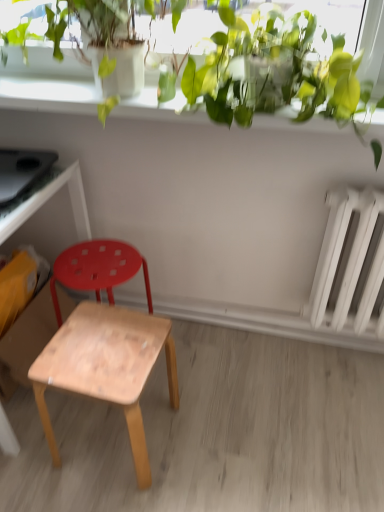
Question: Is white matte radiator at right in front of or behind green leafy plant at upper center in the image?

Choices:
 (A) front
 (B) behind

Answer: (B)

Question: Is point (354, 241) closer or farther from the camera than point (304, 38)?

Choices:
 (A) farther
 (B) closer

Answer: (A)

Question: Considering the real-world distances, which object is closest to the white matte radiator at right?

Choices:
 (A) green leafy plant at upper center
 (B) wooden desk at left
 (C) natural wood stool at center, which is the second stool in back-to-front order
 (D) wooden stool at lower left, the 2th stool viewed from the front

Answer: (A)

Question: Which object is the closest to the wooden stool at lower left, marked as the 1th stool in a back-to-front arrangement?

Choices:
 (A) white matte radiator at right
 (B) wooden desk at left
 (C) green leafy plant at upper center
 (D) natural wood stool at center, which is the second stool in back-to-front order

Answer: (B)